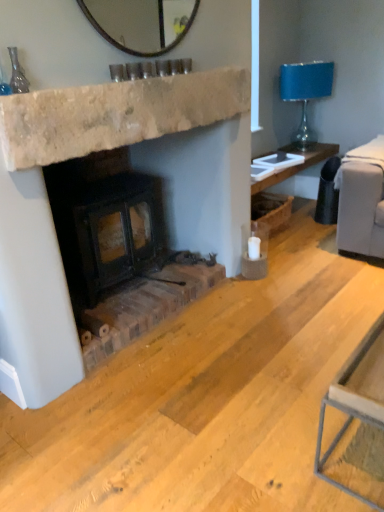
Question: Is rustic brick wood burning stove at center inside the boundaries of blue glass lampshade at upper right, or outside?

Choices:
 (A) inside
 (B) outside

Answer: (B)

Question: From the image's perspective, is rustic brick wood burning stove at center above or below blue glass lampshade at upper right?

Choices:
 (A) below
 (B) above

Answer: (A)

Question: Based on their relative distances, which object is farther from the blue glass lampshade at upper right?

Choices:
 (A) natural stone fireplace at center
 (B) rustic brick wood burning stove at center

Answer: (B)

Question: Which is farther from the natural stone fireplace at center?

Choices:
 (A) blue glass lampshade at upper right
 (B) rustic brick wood burning stove at center

Answer: (A)